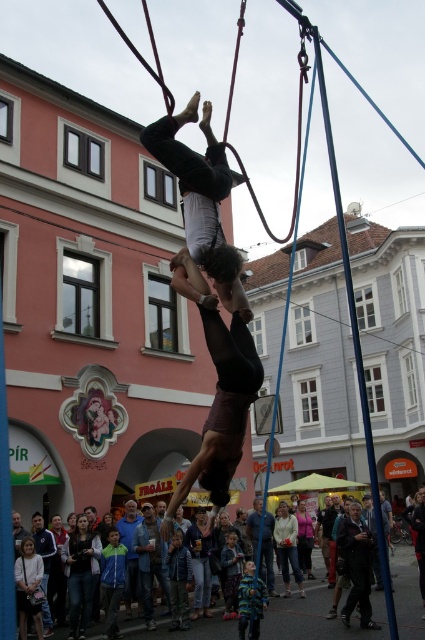
Who is higher up, dark clothing crowd at lower center or blue denim jeans at center?

blue denim jeans at center is above.

This screenshot has height=640, width=425. Describe the element at coordinates (316, 618) in the screenshot. I see `dark clothing crowd at lower center` at that location.

Which is in front, point (376, 602) or point (269, 573)?

Positioned in front is point (376, 602).

Find the location of a particular element. The width and height of the screenshot is (425, 640). dark clothing crowd at lower center is located at coordinates (316, 618).

Is denim jacket at center closer to camera compared to blue denim jeans at center?

Yes, denim jacket at center is closer to the viewer.

Consider the image. Who is higher up, denim jacket at center or blue denim jeans at center?

Positioned higher is denim jacket at center.

The width and height of the screenshot is (425, 640). Find the location of `denim jacket at center`. denim jacket at center is located at coordinates (150, 561).

Looking at this image, can you confirm if dark clothing crowd at lower center is smaller than light beige sweater at center?

Incorrect, dark clothing crowd at lower center is not smaller in size than light beige sweater at center.

At what (x,y) coordinates should I click in order to perform the action: click on dark clothing crowd at lower center. Please return your answer as a coordinate pair (x, y). Looking at the image, I should click on (316, 618).